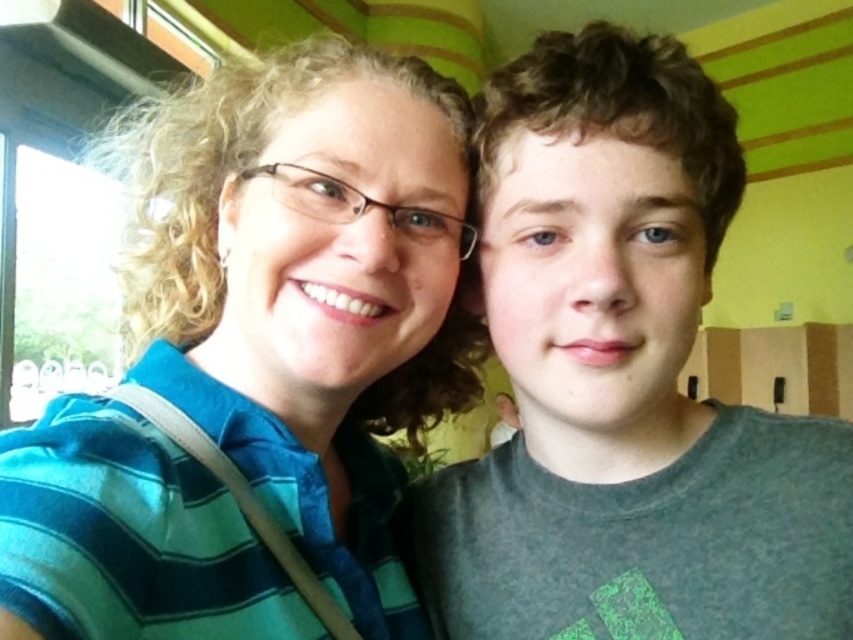
Question: Can you confirm if blue striped shirt at upper left is positioned above matte gray shirt at right?

Choices:
 (A) yes
 (B) no

Answer: (A)

Question: Which of the following is the farthest from the observer?

Choices:
 (A) (569, 362)
 (B) (193, 195)

Answer: (B)

Question: Among these objects, which one is farthest from the camera?

Choices:
 (A) matte gray shirt at right
 (B) blue striped shirt at upper left

Answer: (A)

Question: Is blue striped shirt at upper left thinner than matte gray shirt at right?

Choices:
 (A) yes
 (B) no

Answer: (B)

Question: From the image, what is the correct spatial relationship of blue striped shirt at upper left in relation to matte gray shirt at right?

Choices:
 (A) above
 (B) below

Answer: (A)

Question: Among these objects, which one is nearest to the camera?

Choices:
 (A) blue striped shirt at upper left
 (B) matte gray shirt at right

Answer: (A)